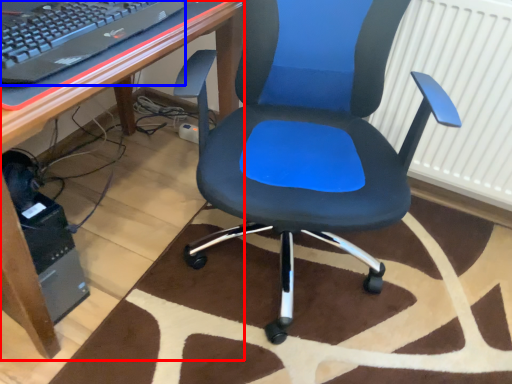
Question: Which object appears closest to the camera in this image, desk (highlighted by a red box) or computer keyboard (highlighted by a blue box)?

Choices:
 (A) desk
 (B) computer keyboard

Answer: (A)